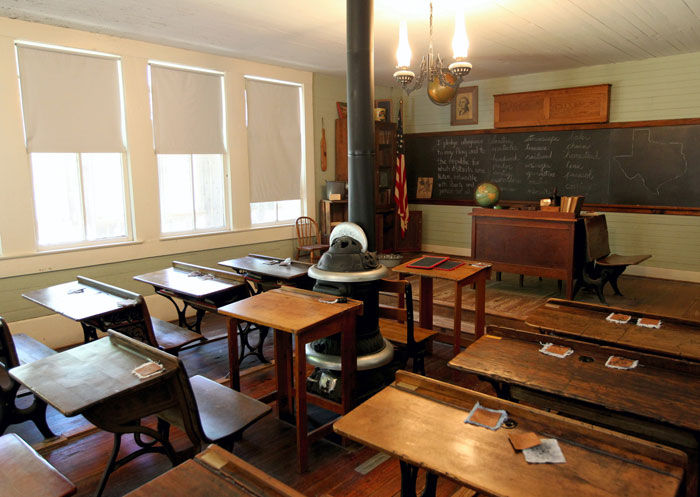
Where is `windows`? The width and height of the screenshot is (700, 497). windows is located at coordinates (88, 200), (192, 183), (283, 210).